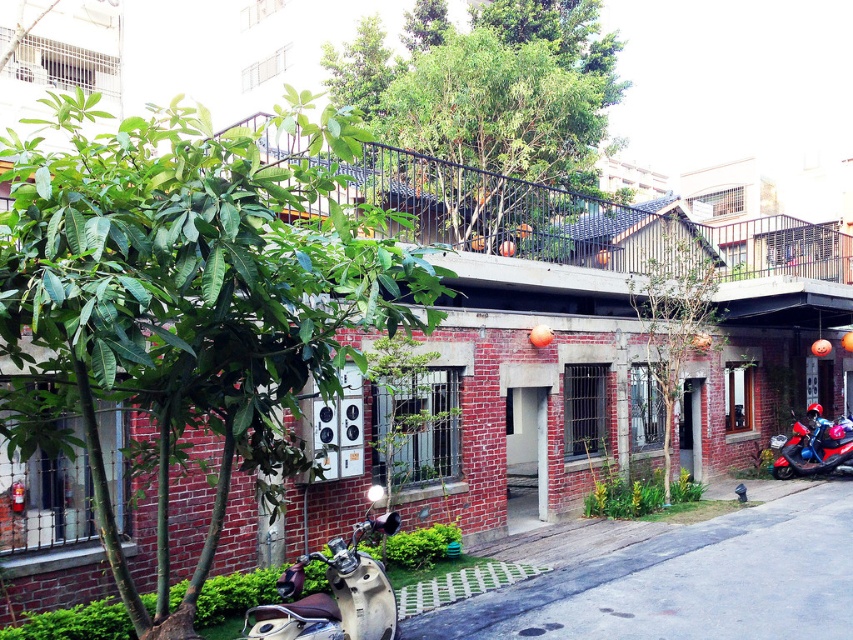
Question: Does green leafy tree at upper center appear on the right side of beige leather motorcycle at lower left?

Choices:
 (A) yes
 (B) no

Answer: (A)

Question: Which object appears farthest from the camera in this image?

Choices:
 (A) green leafy tree at left
 (B) green leafy tree at center
 (C) shiny blue motorcycle at lower right

Answer: (C)

Question: Which object appears farthest from the camera in this image?

Choices:
 (A) shiny blue motorcycle at lower right
 (B) beige leather motorcycle at lower left
 (C) green leafy tree at upper center
 (D) green leafy tree at center

Answer: (A)

Question: Among these points, which one is farthest from the camera?

Choices:
 (A) (415, 22)
 (B) (367, 621)

Answer: (A)

Question: Is green leafy tree at upper center above shiny blue motorcycle at lower right?

Choices:
 (A) no
 (B) yes

Answer: (B)

Question: Does green leafy tree at center come behind shiny blue motorcycle at lower right?

Choices:
 (A) no
 (B) yes

Answer: (A)